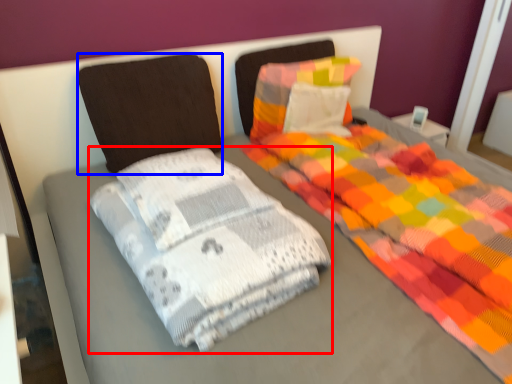
Question: Among these objects, which one is farthest to the camera, material (highlighted by a red box) or pillow (highlighted by a blue box)?

Choices:
 (A) material
 (B) pillow

Answer: (B)